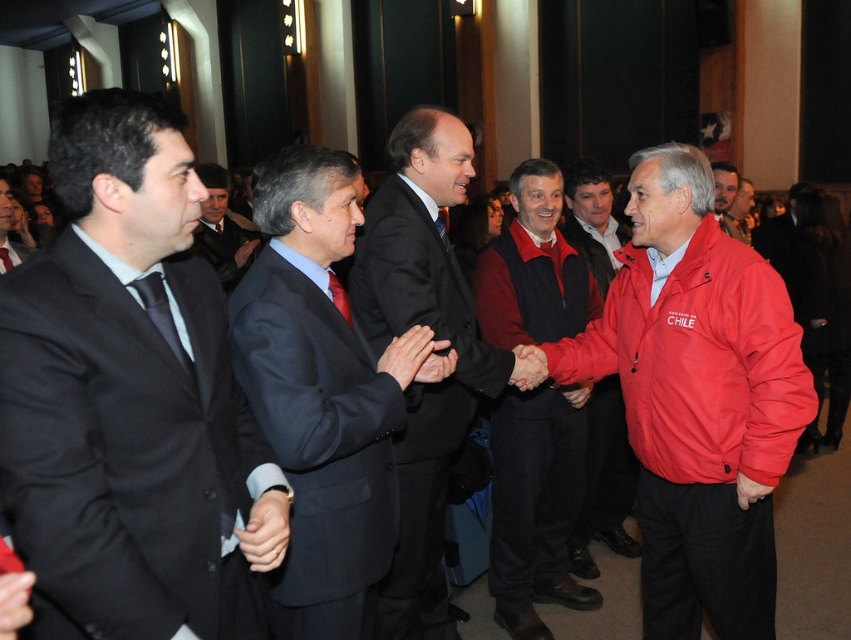
Find the location of `dark suit at center`. dark suit at center is located at coordinates (433, 339).

Image resolution: width=851 pixels, height=640 pixels. What do you see at coordinates (433, 339) in the screenshot?
I see `dark suit at center` at bounding box center [433, 339].

I want to click on dark suit at center, so click(433, 339).

Between black suit at center and red fleece jacket at center, which one is positioned lower?

Positioned lower is red fleece jacket at center.

Between black suit at center and red fleece jacket at center, which one has less height?

black suit at center is shorter.

Which is behind, point (210, 305) or point (524, 269)?

Positioned behind is point (524, 269).

At what (x,y) coordinates should I click in order to perform the action: click on black suit at center. Please return your answer as a coordinate pair (x, y). Looking at the image, I should click on (130, 397).

Which of these two, dark suit at center or red matte jacket at center, stands taller?

Standing taller between the two is dark suit at center.

Where is `dark suit at center`? dark suit at center is located at coordinates (433, 339).

Is point (452, 336) behind point (586, 227)?

No, it is in front of (586, 227).

Locate an element on the screen. dark suit at center is located at coordinates (433, 339).